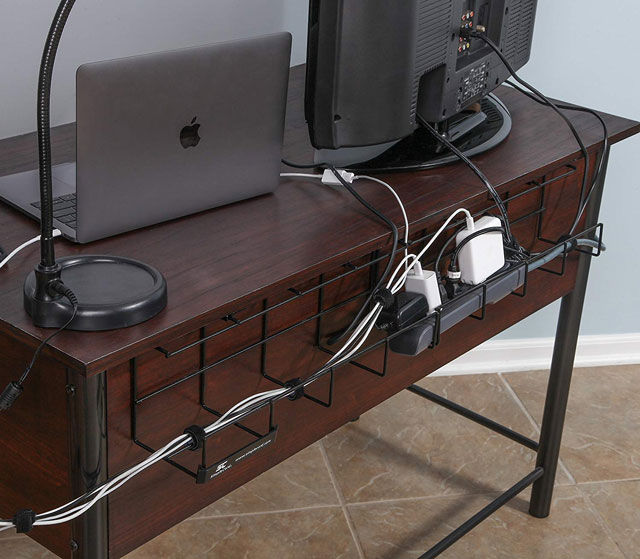
At what (x,y) coordinates should I click in order to perform the action: click on floor tiles. Please return your answer as a coordinate pair (x, y). This screenshot has height=559, width=640. Looking at the image, I should click on coord(307,487), coord(377,468), coord(294,530), coord(412,522), coord(576,435), coord(605,498), coord(18,546).